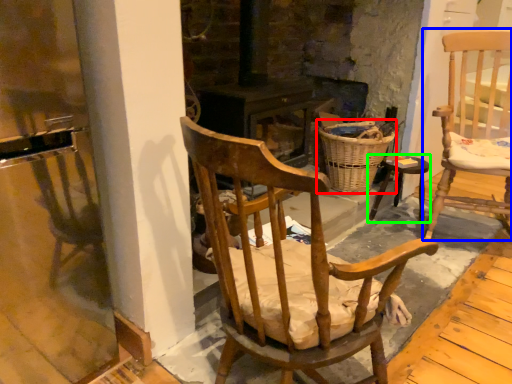
Question: Which object is the farthest from basket (highlighted by a red box)? Choose among these: chair (highlighted by a blue box) or stool (highlighted by a green box).

Choices:
 (A) chair
 (B) stool

Answer: (A)